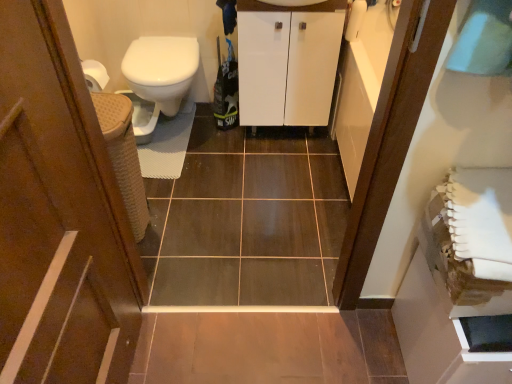
Describe the element at coordinates (288, 62) in the screenshot. I see `white glossy cabinet at center` at that location.

The image size is (512, 384). I want to click on brown wood door at left, so click(59, 216).

Identify the location of bathroom cabinet behind the brown wood door at left. Image resolution: width=512 pixels, height=384 pixels. (288, 62).

Who is shorter, brown wood door at left or white glossy cabinet at center?

With less height is white glossy cabinet at center.

Is brown wood door at left turned away from white glossy cabinet at center?

No, brown wood door at left's orientation is not away from white glossy cabinet at center.

From the image's perspective, is brown wood door at left located beneath white glossy cabinet at center?

Yes, from the image's perspective, brown wood door at left is beneath white glossy cabinet at center.

Which of these two, white glossy bidet at left or white glossy cabinet at center, stands taller?

white glossy cabinet at center is taller.

Is white glossy bidet at left positioned far away from white glossy cabinet at center?

They are positioned close to each other.

Considering the sizes of objects white glossy bidet at left and white glossy cabinet at center in the image provided, who is wider, white glossy bidet at left or white glossy cabinet at center?

Wider between the two is white glossy bidet at left.

Is point (178, 100) farther from camera compared to point (252, 29)?

Yes, it is behind point (252, 29).

From the image's perspective, is white glossy cabinet at center beneath brown wood door at left?

No.

From their relative heights in the image, would you say white glossy cabinet at center is taller or shorter than brown wood door at left?

Clearly, white glossy cabinet at center is shorter compared to brown wood door at left.

Is brown wood door at left surrounded by white glossy cabinet at center?

No.

Which is more to the left, white glossy cabinet at center or brown wood door at left?

brown wood door at left.

From the image's perspective, which one is positioned higher, white glossy cabinet at center or white glossy bidet at left?

white glossy cabinet at center, from the image's perspective.

Who is smaller, white glossy cabinet at center or white glossy bidet at left?

Smaller between the two is white glossy bidet at left.

Is the depth of white glossy cabinet at center less than that of white glossy bidet at left?

Yes, white glossy cabinet at center is closer to the camera.

Is white glossy bidet at left completely or partially outside of brown wood door at left?

Yes.

From the image's perspective, which one is positioned lower, white glossy bidet at left or brown wood door at left?

brown wood door at left appears lower in the image.

Can you tell me how much white glossy bidet at left and brown wood door at left differ in facing direction?

89.8 degrees.

From a real-world perspective, does white glossy bidet at left sit lower than brown wood door at left?

Yes, from a real-world perspective, white glossy bidet at left is under brown wood door at left.

Considering the sizes of objects brown wood door at left and white glossy bidet at left in the image provided, who is shorter, brown wood door at left or white glossy bidet at left?

With less height is white glossy bidet at left.

Does point (27, 78) come behind point (165, 98)?

No, (27, 78) is closer to viewer.

The width and height of the screenshot is (512, 384). I want to click on door that is below the white glossy bidet at left (from the image's perspective), so click(x=59, y=216).

In the image, is brown wood door at left on the left side or the right side of white glossy bidet at left?

From the image, it's evident that brown wood door at left is to the right of white glossy bidet at left.

Locate an element on the screen. The height and width of the screenshot is (384, 512). bathroom cabinet that is under the brown wood door at left (from a real-world perspective) is located at coordinates click(288, 62).

What are the coordinates of `bidet below the white glossy cabinet at center (from the image's perspective)` in the screenshot? It's located at (161, 69).

Which object lies further to the anchor point white glossy cabinet at center, white glossy bidet at left or brown wood door at left?

brown wood door at left lies further to white glossy cabinet at center than the other object.

Estimate the real-world distances between objects in this image. Which object is closer to brown wood door at left, white glossy bidet at left or white glossy cabinet at center?

white glossy bidet at left.

Estimate the real-world distances between objects in this image. Which object is further from white glossy bidet at left, brown wood door at left or white glossy cabinet at center?

Among the two, brown wood door at left is located further to white glossy bidet at left.

Based on their spatial positions, is brown wood door at left or white glossy bidet at left further from white glossy cabinet at center?

The object further to white glossy cabinet at center is brown wood door at left.

Consider the image. Looking at the image, which one is located closer to white glossy bidet at left, white glossy cabinet at center or brown wood door at left?

white glossy cabinet at center is closer to white glossy bidet at left.

From the image, which object appears to be nearer to brown wood door at left, white glossy cabinet at center or white glossy bidet at left?

Among the two, white glossy bidet at left is located nearer to brown wood door at left.

At what (x,y) coordinates should I click in order to perform the action: click on bathroom cabinet located between brown wood door at left and white glossy bidet at left in the depth direction. Please return your answer as a coordinate pair (x, y). Image resolution: width=512 pixels, height=384 pixels. Looking at the image, I should click on (288, 62).